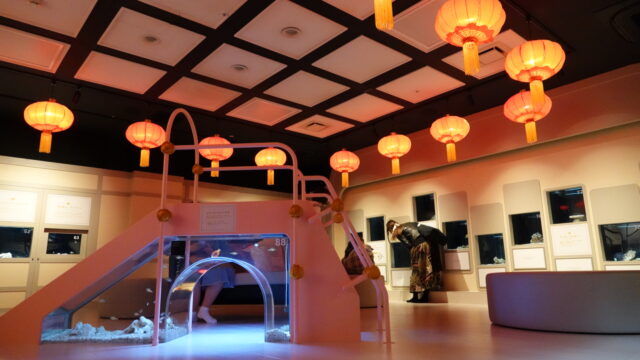
The height and width of the screenshot is (360, 640). What are the coordinates of `ceiling` in the screenshot? It's located at point(589,59).